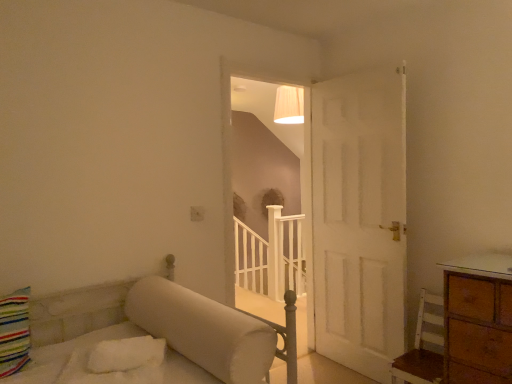
Question: From the image's perspective, is white matte staircase at center located above white wooden balustrade at center?

Choices:
 (A) no
 (B) yes

Answer: (B)

Question: From a real-world perspective, is white matte staircase at center over white wooden balustrade at center?

Choices:
 (A) no
 (B) yes

Answer: (B)

Question: Is white matte staircase at center next to white wooden balustrade at center and touching it?

Choices:
 (A) yes
 (B) no

Answer: (B)

Question: Is white matte staircase at center smaller than white wooden balustrade at center?

Choices:
 (A) no
 (B) yes

Answer: (B)

Question: Does white matte staircase at center turn towards white wooden balustrade at center?

Choices:
 (A) no
 (B) yes

Answer: (A)

Question: Considering the relative positions of white matte staircase at center and white wooden balustrade at center in the image provided, is white matte staircase at center in front of white wooden balustrade at center?

Choices:
 (A) yes
 (B) no

Answer: (A)

Question: Is white matte staircase at center to the left of white wood chair at lower right from the viewer's perspective?

Choices:
 (A) no
 (B) yes

Answer: (B)

Question: Is white matte staircase at center smaller than white wood chair at lower right?

Choices:
 (A) yes
 (B) no

Answer: (B)

Question: Is white matte staircase at center wider than white wood chair at lower right?

Choices:
 (A) no
 (B) yes

Answer: (A)

Question: Is white matte staircase at center not within white wood chair at lower right?

Choices:
 (A) yes
 (B) no

Answer: (A)

Question: Considering the relative sizes of white matte staircase at center and white wood chair at lower right in the image provided, is white matte staircase at center shorter than white wood chair at lower right?

Choices:
 (A) yes
 (B) no

Answer: (B)

Question: From a real-world perspective, is white matte staircase at center positioned under white wood chair at lower right based on gravity?

Choices:
 (A) yes
 (B) no

Answer: (B)

Question: Is white wooden balustrade at center completely or partially outside of white wood chair at lower right?

Choices:
 (A) yes
 (B) no

Answer: (A)